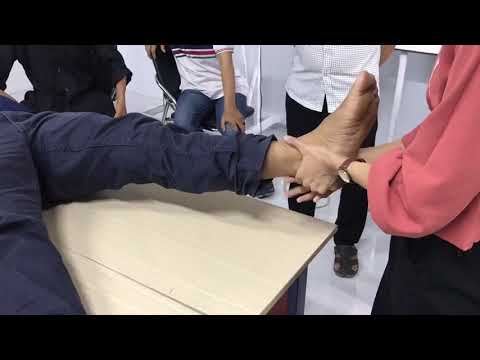
Find the location of a particular element. shoe is located at coordinates (346, 259).